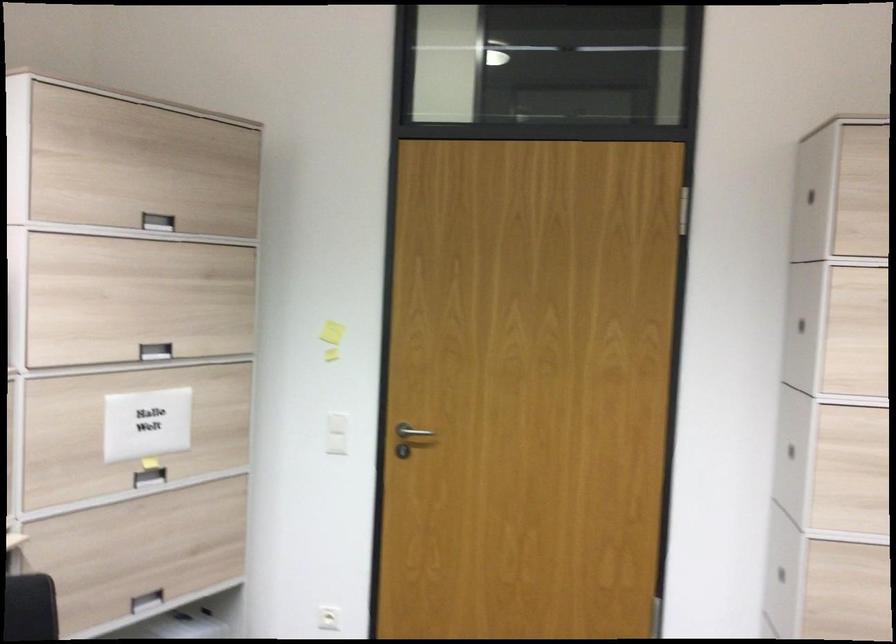
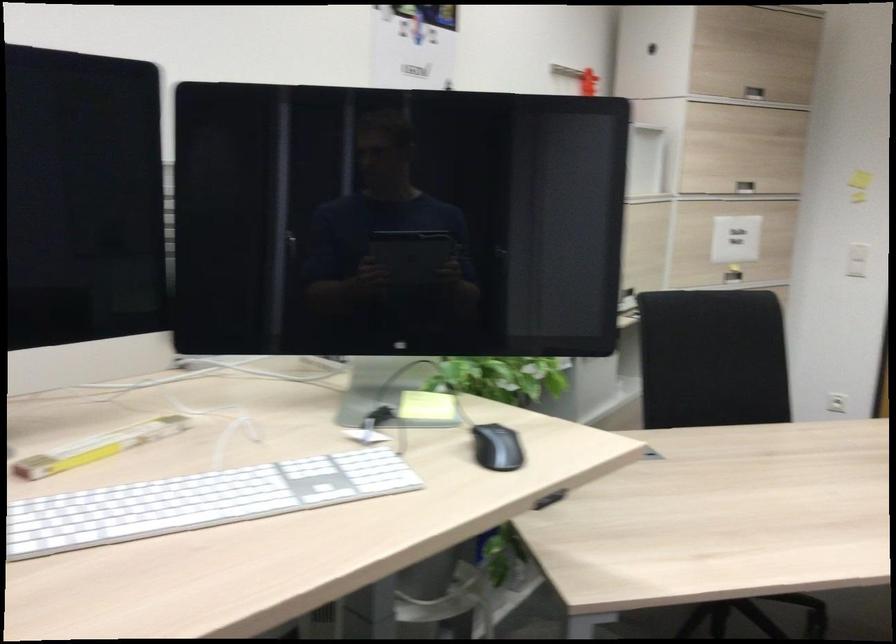
Locate, in the second image, the point that corresponds to point 314,437 in the first image.

(857, 260)